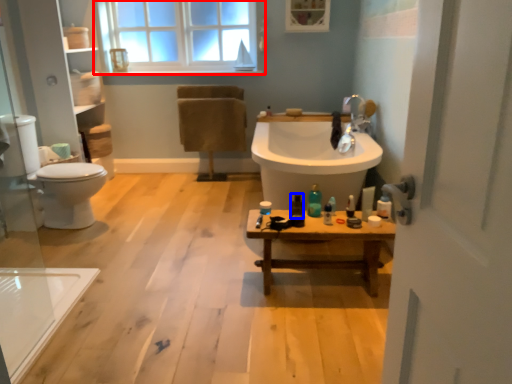
Question: Among these objects, which one is nearest to the camera, window (highlighted by a red box) or toiletry (highlighted by a blue box)?

Choices:
 (A) window
 (B) toiletry

Answer: (B)